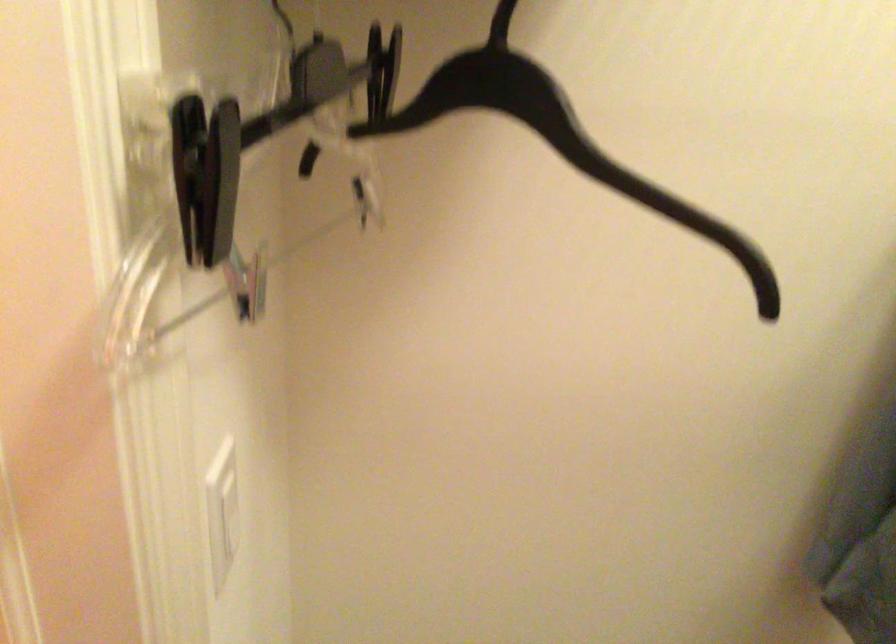
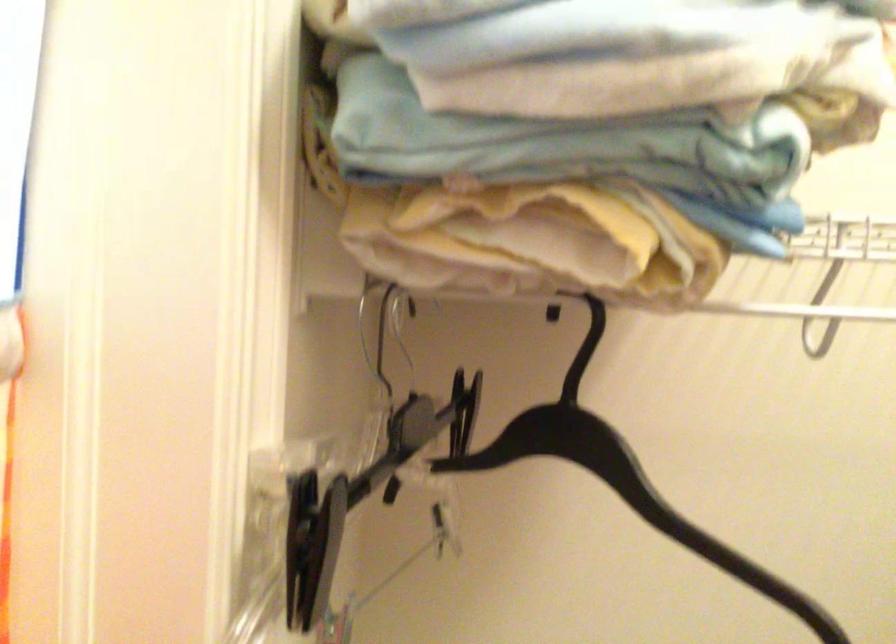
Question: Based on the continuous images, in which direction is the camera rotating? Reply with the corresponding letter.

Choices:
 (A) Left
 (B) Right
 (C) Up
 (D) Down

Answer: (C)